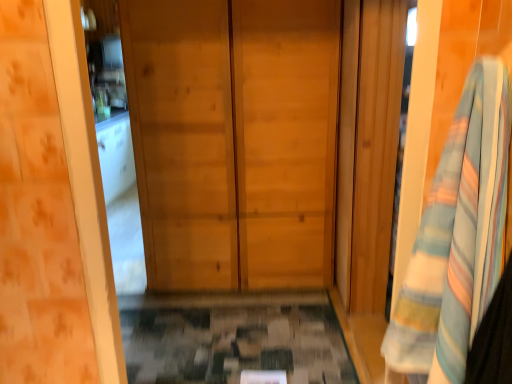
Question: From the image's perspective, is striped cotton bath towel at right located above or below natural wood door at center?

Choices:
 (A) below
 (B) above

Answer: (A)

Question: From a real-world perspective, is striped cotton bath towel at right physically located above or below natural wood door at center?

Choices:
 (A) below
 (B) above

Answer: (B)

Question: Based on their sizes in the image, would you say striped cotton bath towel at right is bigger or smaller than natural wood door at center?

Choices:
 (A) big
 (B) small

Answer: (B)

Question: Visually, is natural wood door at center positioned to the left or to the right of striped cotton bath towel at right?

Choices:
 (A) left
 (B) right

Answer: (A)

Question: In the image, is natural wood door at center positioned in front of or behind striped cotton bath towel at right?

Choices:
 (A) front
 (B) behind

Answer: (B)

Question: Looking at their shapes, would you say natural wood door at center is wider or thinner than striped cotton bath towel at right?

Choices:
 (A) thin
 (B) wide

Answer: (B)

Question: From their relative heights in the image, would you say natural wood door at center is taller or shorter than striped cotton bath towel at right?

Choices:
 (A) tall
 (B) short

Answer: (A)